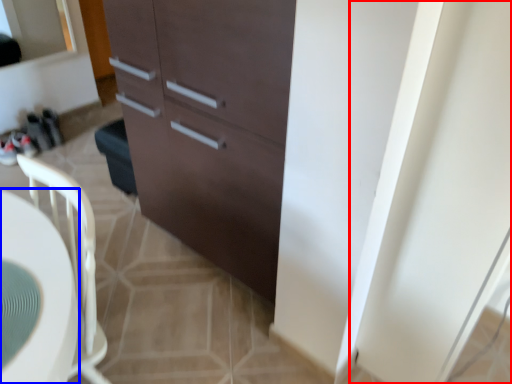
Question: Which object appears farthest to the camera in this image, screen door (highlighted by a red box) or desk (highlighted by a blue box)?

Choices:
 (A) screen door
 (B) desk

Answer: (A)